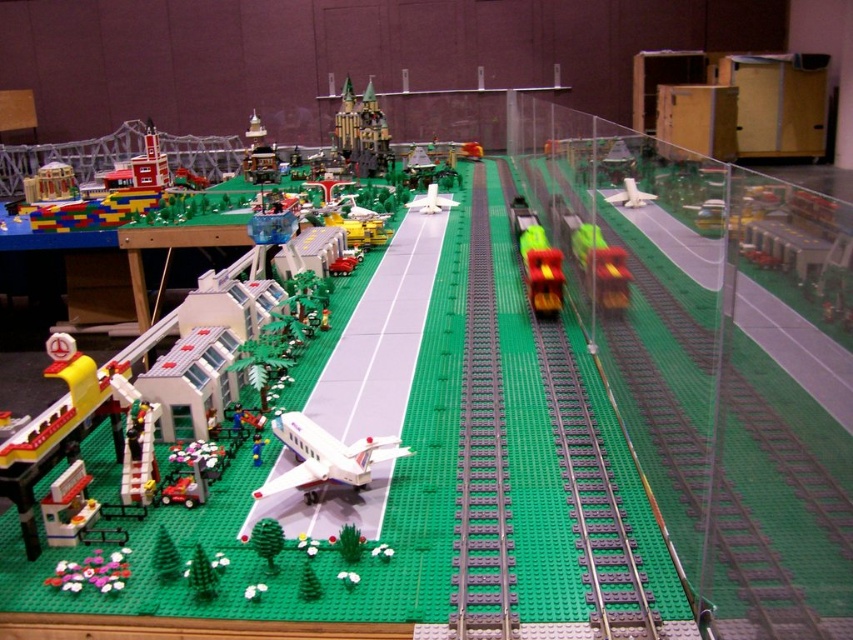
You are a Lego model designer who wants to place a new Lego car between the shiny yellow train at center and the white matte airplane at center. The car is 10cm wide. Can the car fit between them without overlapping either?

The shiny yellow train at center is narrower than the white matte airplane at center. However, the exact width of the space between them isn not specified. Since the train is narrower, but the airplane is wider, the available space might be sufficient. However, without knowing the distance between them, it is impossible to determine if the 10cm car will fit without overlapping.

You are a Lego enthusiast trying to fit both the brick castle at center and the white matte airplane at center onto a display shelf. The shelf has a space that can only accommodate the smaller of the two. Which object should you place on the shelf?

The white matte airplane at center is smaller than the brick castle at center, so you should place the white matte airplane at center on the shelf.

You are a Lego figure standing at the edge of the green grass area. You want to walk to the white plastic airplane at center without stepping on the green plastic train track at center. Is this possible?

The green plastic train track at center is in front of the white plastic airplane at center, so you would have to step over or around the track to reach the airplane without stepping on it.